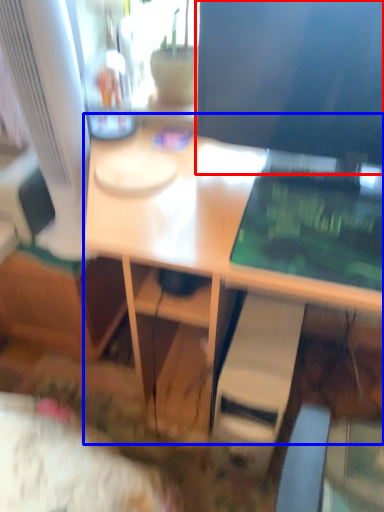
Question: Among these objects, which one is nearest to the camera, computer monitor (highlighted by a red box) or desk (highlighted by a blue box)?

Choices:
 (A) computer monitor
 (B) desk

Answer: (B)